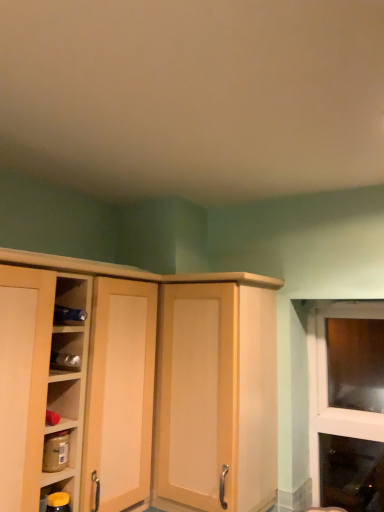
Question: Does point (210, 475) appear closer or farther from the camera than point (44, 505)?

Choices:
 (A) farther
 (B) closer

Answer: (A)

Question: Considering the positions of matte wood cupboard at left and yellow matte jar at lower left, the first shelf when ordered from bottom to top, in the image, is matte wood cupboard at left wider or thinner than yellow matte jar at lower left, the first shelf when ordered from bottom to top,?

Choices:
 (A) thin
 (B) wide

Answer: (B)

Question: Considering the real-world distances, which object is closest to the matte brown jar at lower left, arranged as the 1th shelf when viewed from the top?

Choices:
 (A) matte wood cabinet at center
 (B) yellow matte jar at lower left, the first shelf when ordered from bottom to top
 (C) matte wood cupboard at left

Answer: (B)

Question: Estimate the real-world distances between objects in this image. Which object is farther from the matte wood cabinet at center?

Choices:
 (A) matte wood cupboard at left
 (B) matte brown jar at lower left, arranged as the 1th shelf when viewed from the top
 (C) yellow matte jar at lower left, the first shelf when ordered from bottom to top

Answer: (C)